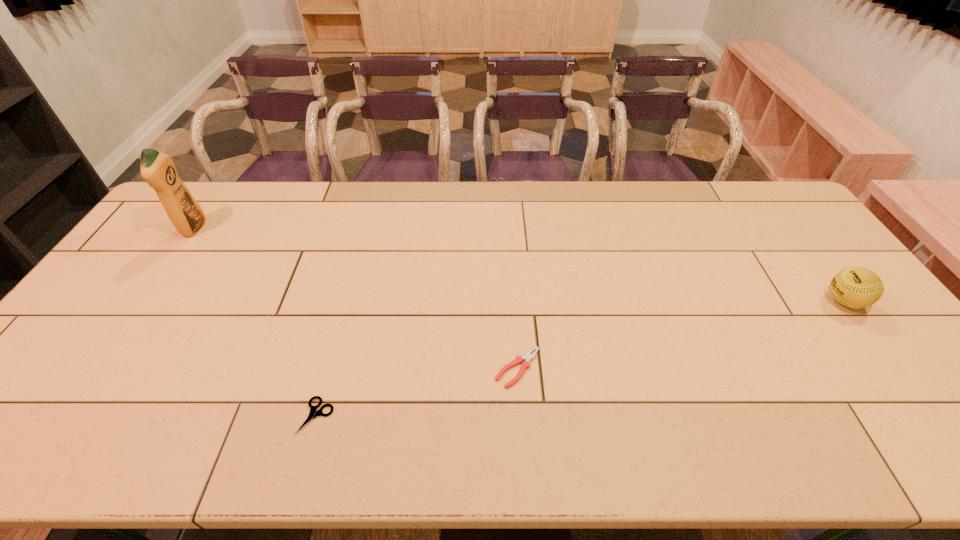
Where is `free spot located on the logo side of the second tallest object`? free spot located on the logo side of the second tallest object is located at coordinates (775, 301).

This screenshot has width=960, height=540. Find the location of `free spot located on the logo side of the second tallest object`. free spot located on the logo side of the second tallest object is located at coordinates (754, 301).

Identify the location of vacant space located 0.050m on the back of the third object from left to right. (516, 333).

Where is `vacant region located 0.240m on the left of the nearest object`? This screenshot has width=960, height=540. vacant region located 0.240m on the left of the nearest object is located at coordinates (196, 416).

The height and width of the screenshot is (540, 960). I want to click on object positioned at the far edge, so point(158,170).

Locate an element on the screen. Image resolution: width=960 pixels, height=540 pixels. object located in the near edge section of the desktop is located at coordinates (313, 413).

Identify the location of object that is at the left edge. The image size is (960, 540). (158, 170).

Identify the location of object that is at the right edge. The width and height of the screenshot is (960, 540). (855, 287).

Locate an element on the screen. object at the far left corner is located at coordinates (158, 170).

You are a GUI agent. You are given a task and a screenshot of the screen. Output one action in this format:
    pyautogui.click(x=<x>, y=<y>)
    Task: Click on the free space at the far edge
    
    Given the screenshot: What is the action you would take?
    pyautogui.click(x=670, y=211)